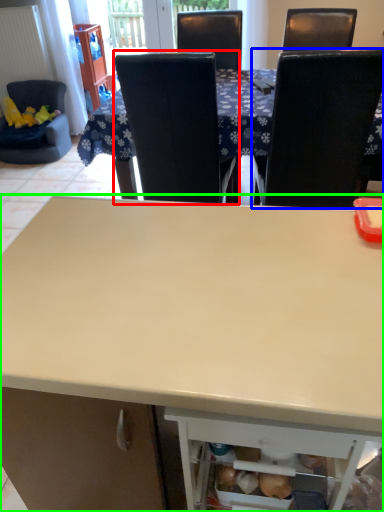
Question: Estimate the real-world distances between objects in this image. Which object is closer to chair (highlighted by a red box), chair (highlighted by a blue box) or desk (highlighted by a green box)?

Choices:
 (A) chair
 (B) desk

Answer: (A)